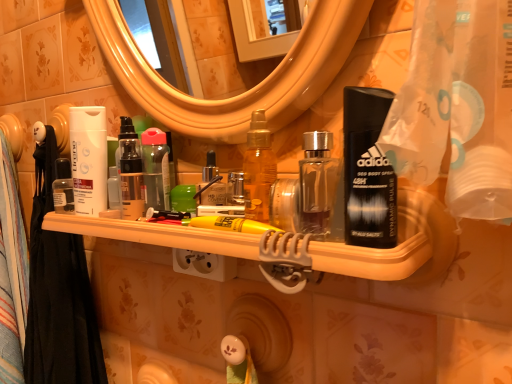
Question: Should I look upward or downward to see black fabric shower curtain at left?

Choices:
 (A) up
 (B) down

Answer: (B)

Question: Can you confirm if matte black lotion at center is wider than translucent plastic shelf at center?

Choices:
 (A) no
 (B) yes

Answer: (A)

Question: Could you tell me if matte black lotion at center is turned towards translucent plastic shelf at center?

Choices:
 (A) yes
 (B) no

Answer: (B)

Question: Considering the relative sizes of matte black lotion at center and translucent plastic shelf at center in the image provided, is matte black lotion at center shorter than translucent plastic shelf at center?

Choices:
 (A) yes
 (B) no

Answer: (B)

Question: Is matte black lotion at center located outside translucent plastic shelf at center?

Choices:
 (A) no
 (B) yes

Answer: (B)

Question: Is matte black lotion at center bigger than translucent plastic shelf at center?

Choices:
 (A) yes
 (B) no

Answer: (B)

Question: From a real-world perspective, is matte black lotion at center located beneath translucent plastic shelf at center?

Choices:
 (A) no
 (B) yes

Answer: (A)

Question: Is matte black lotion at center far from black fabric shower curtain at left?

Choices:
 (A) no
 (B) yes

Answer: (A)

Question: Is matte black lotion at center oriented away from black fabric shower curtain at left?

Choices:
 (A) no
 (B) yes

Answer: (A)

Question: From the image's perspective, is matte black lotion at center under black fabric shower curtain at left?

Choices:
 (A) yes
 (B) no

Answer: (B)

Question: Is matte black lotion at center directly adjacent to black fabric shower curtain at left?

Choices:
 (A) yes
 (B) no

Answer: (B)

Question: Can we say matte black lotion at center lies outside black fabric shower curtain at left?

Choices:
 (A) no
 (B) yes

Answer: (B)

Question: Is matte black lotion at center facing towards black fabric shower curtain at left?

Choices:
 (A) no
 (B) yes

Answer: (A)

Question: Can you confirm if white matte lotion at left is positioned to the right of black fabric shower curtain at left?

Choices:
 (A) no
 (B) yes

Answer: (B)